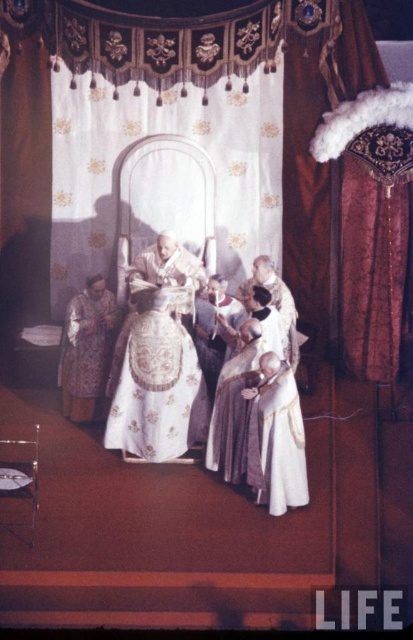
Can you confirm if white embroidered robe at center is wider than white satin robe at center?

Correct, the width of white embroidered robe at center exceeds that of white satin robe at center.

Who is more forward, (137, 340) or (265, 371)?

Point (265, 371)

The height and width of the screenshot is (640, 413). I want to click on white embroidered robe at center, so click(156, 384).

Based on the photo, does white satin robe at center appear over silky purple robe at lower left?

Incorrect, white satin robe at center is not positioned above silky purple robe at lower left.

This screenshot has width=413, height=640. In order to click on white satin robe at center in this screenshot , I will do `click(275, 438)`.

Between white embroidered robe at center and silky purple robe at lower left, which one is positioned lower?

white embroidered robe at center is lower down.

Which is in front, point (190, 301) or point (83, 346)?

Point (190, 301)

Where is `white embroidered robe at center`? This screenshot has height=640, width=413. white embroidered robe at center is located at coordinates (156, 384).